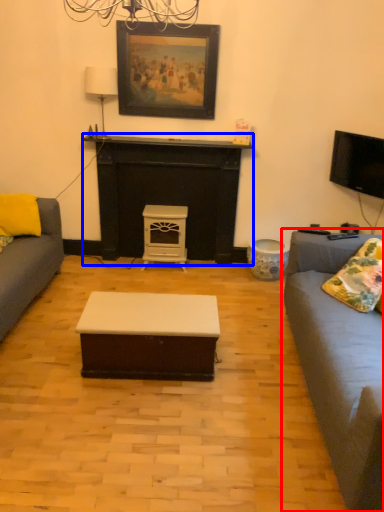
Question: Which point is further to the camera, studio couch (highlighted by a red box) or fireplace (highlighted by a blue box)?

Choices:
 (A) studio couch
 (B) fireplace

Answer: (B)